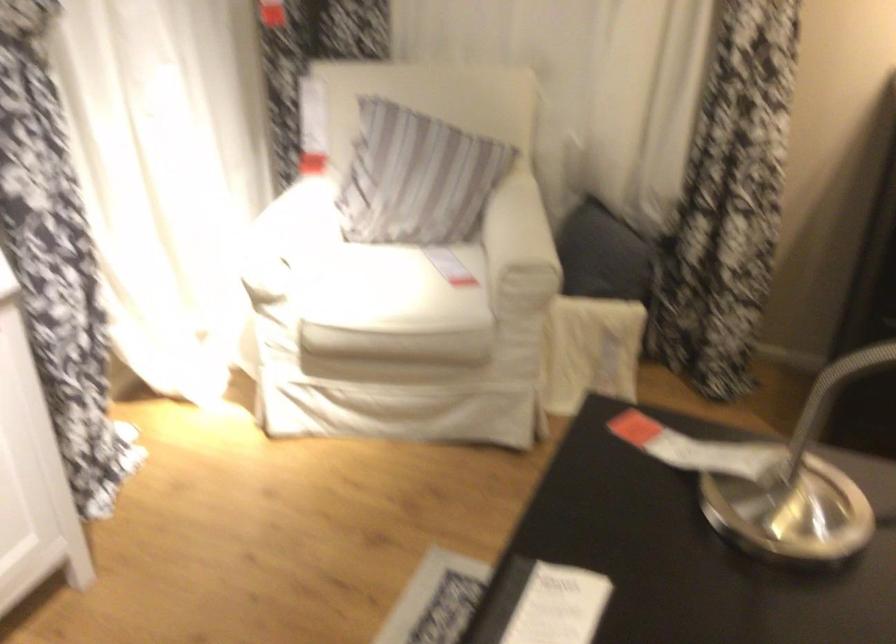
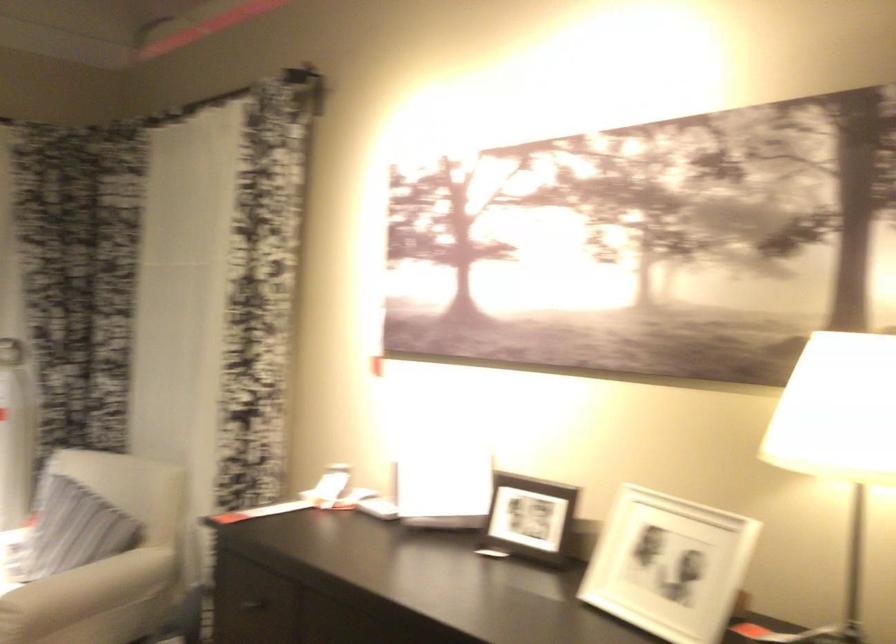
In the second image, find the point that corresponds to point 544,239 in the first image.

(85, 592)